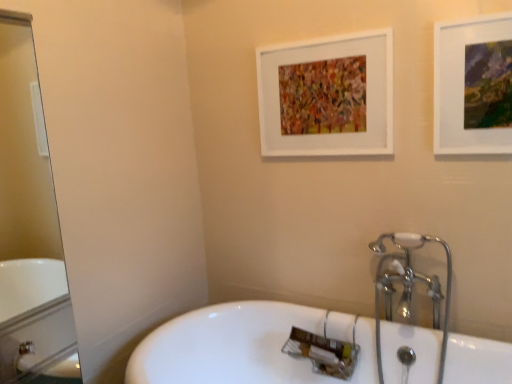
Question: From their relative heights in the image, would you say white matte picture frame at upper center, placed as the 1th picture frame when sorted from left to right, is taller or shorter than white glossy bathtub at center?

Choices:
 (A) tall
 (B) short

Answer: (B)

Question: Is white matte picture frame at upper center, the second picture frame in the right-to-left sequence, situated inside white glossy bathtub at center or outside?

Choices:
 (A) outside
 (B) inside

Answer: (A)

Question: Which is farther from the clear glass mirror at left?

Choices:
 (A) chrome metallic faucet at right
 (B) white glossy bathtub at center
 (C) white matte picture frame at upper center, which is the 2th picture frame from front to back
 (D) matte white picture frame at upper right, arranged as the 1th picture frame when viewed from the front

Answer: (D)

Question: Which of these objects is positioned closest to the white glossy bathtub at center?

Choices:
 (A) chrome metallic faucet at right
 (B) clear glass mirror at left
 (C) white matte picture frame at upper center, placed as the 1th picture frame when sorted from left to right
 (D) matte white picture frame at upper right, the 1th picture frame from the right

Answer: (A)